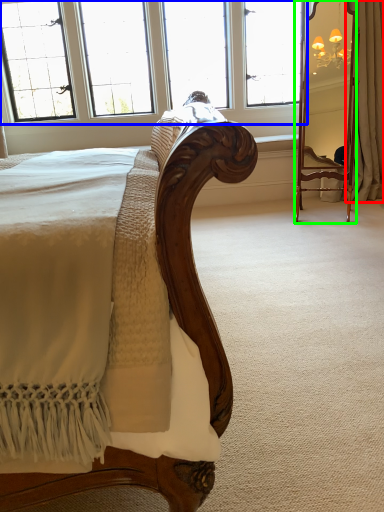
Question: Which object is positioned closest to curtain (highlighted by a red box)? Select from window (highlighted by a blue box) and mirror (highlighted by a green box).

Choices:
 (A) window
 (B) mirror

Answer: (B)